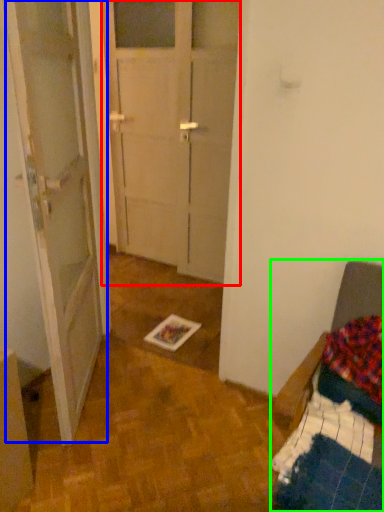
Question: Which object is the farthest from glass door (highlighted by a red box)? Choose among these: barn door (highlighted by a blue box) or furniture (highlighted by a green box).

Choices:
 (A) barn door
 (B) furniture

Answer: (B)